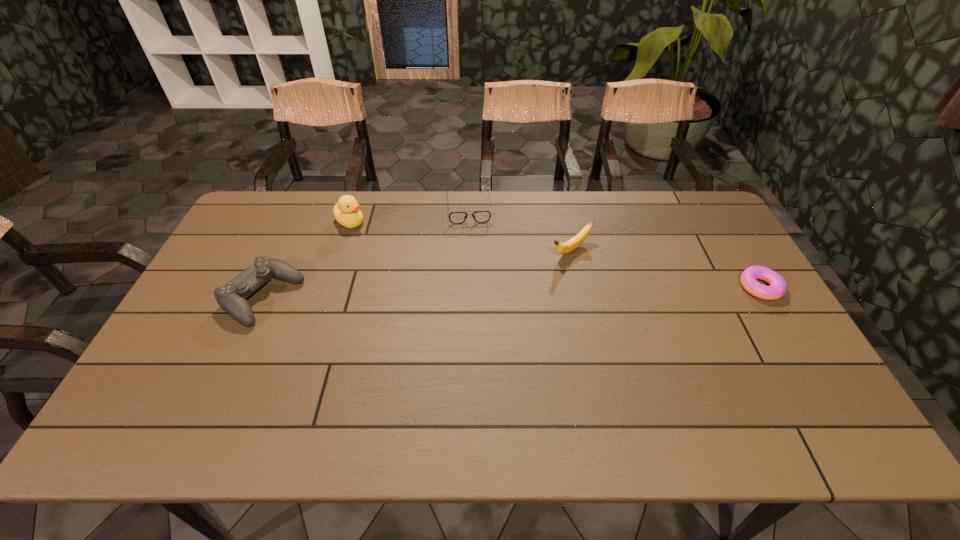
Identify the location of free space on the desktop that is between the leftmost object and the rightmost object and is positioned at the stem of the third farthest object. (507, 293).

Where is `free space on the desktop that is between the control and the rightmost object and is positioned on the front-facing side of the sunglasses`? free space on the desktop that is between the control and the rightmost object and is positioned on the front-facing side of the sunglasses is located at coordinates (476, 293).

Locate an element on the screen. Image resolution: width=960 pixels, height=540 pixels. vacant space on the desktop that is between the third shortest object and the shortest object and is positioned on the face of the duckling is located at coordinates (445, 294).